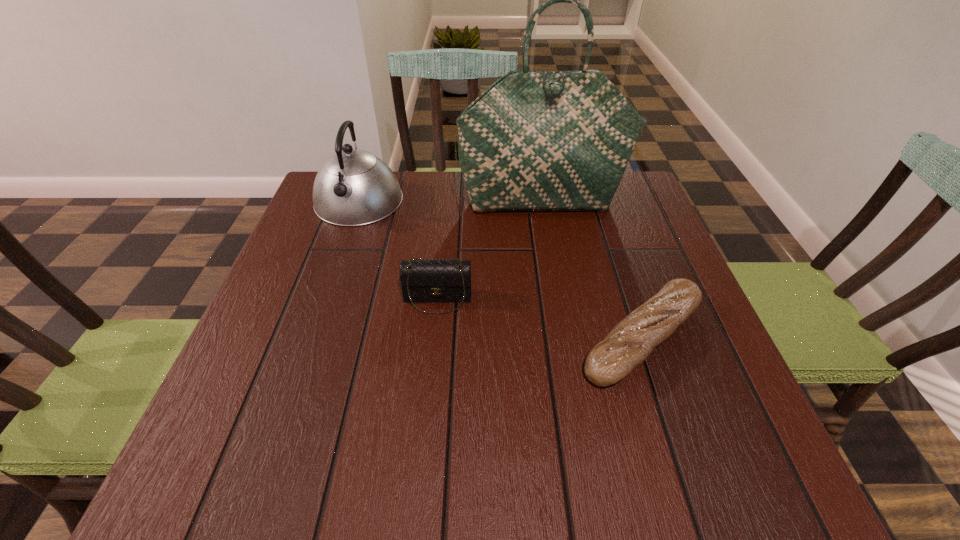
You are a GUI agent. You are given a task and a screenshot of the screen. Output one action in this format:
    pyautogui.click(x=<x>, y=<y>)
    Task: Click on the vacant point located between the shortest object and the clutch bag
    
    Given the screenshot: What is the action you would take?
    coord(540,319)

The image size is (960, 540). In order to click on vacant space in between the baguet and the kettle in this screenshot , I will do `click(500, 270)`.

At what (x,y) coordinates should I click in order to perform the action: click on the third closest object relative to the clutch bag. Please return your answer as a coordinate pair (x, y). This screenshot has height=540, width=960. Looking at the image, I should click on (534, 140).

Choose which object is the nearest neighbor to the tote bag. Please provide its 2D coordinates. Your answer should be formatted as a tuple, i.e. [(x, y)], where the tuple contains the x and y coordinates of a point satisfying the conditions above.

[(353, 187)]

The image size is (960, 540). Find the location of `vacant space that satisfies the following two spatial constraints: 1. on the front flap of the second shortest object; 2. on the right side of the shortest object`. vacant space that satisfies the following two spatial constraints: 1. on the front flap of the second shortest object; 2. on the right side of the shortest object is located at coordinates (434, 338).

Find the location of a particular element. The image size is (960, 540). free space that satisfies the following two spatial constraints: 1. on the front flap of the second shortest object; 2. on the right side of the baguet is located at coordinates (434, 338).

This screenshot has width=960, height=540. Identify the location of vacant space that satisfies the following two spatial constraints: 1. on the front flap of the second shortest object; 2. on the left side of the baguet. (434, 338).

This screenshot has height=540, width=960. I want to click on vacant space that satisfies the following two spatial constraints: 1. from the spout of the leftmost object; 2. on the left side of the baguet, so click(x=311, y=338).

Identify the location of free location that satisfies the following two spatial constraints: 1. from the spout of the kettle; 2. on the left side of the tallest object. (358, 202).

Identify the location of vacant region that satisfies the following two spatial constraints: 1. from the spout of the second tallest object; 2. on the left side of the tote bag. (358, 202).